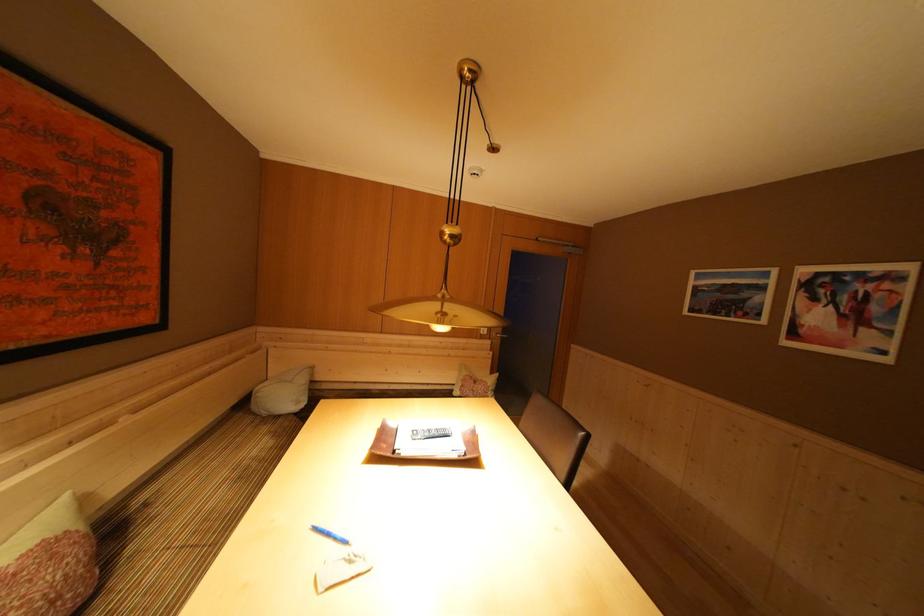
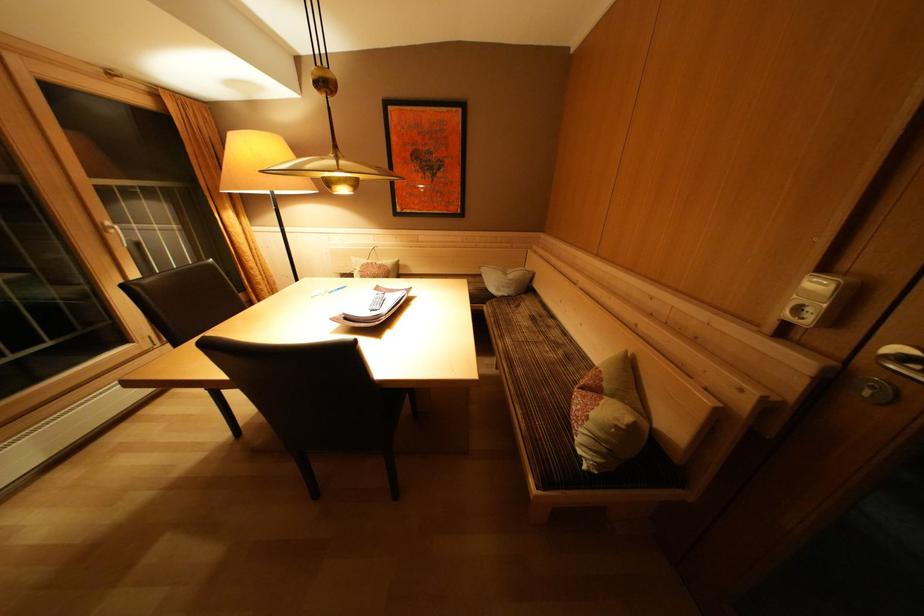
Locate, in the second image, the point that corresponds to point (492, 338) in the first image.

(815, 326)